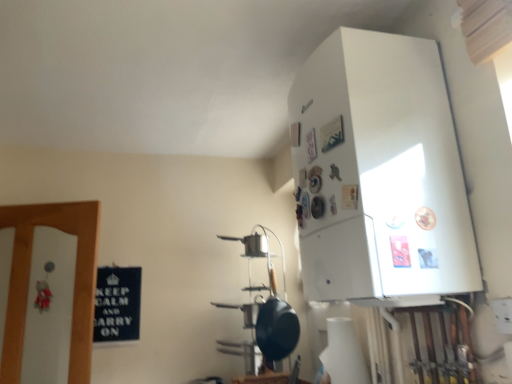
Question: From their relative heights in the image, would you say white glossy refrigerator at upper right is taller or shorter than black matte wok at center?

Choices:
 (A) tall
 (B) short

Answer: (A)

Question: From a real-world perspective, is white glossy refrigerator at upper right positioned above or below black matte wok at center?

Choices:
 (A) above
 (B) below

Answer: (A)

Question: Is white glossy refrigerator at upper right inside or outside of black matte wok at center?

Choices:
 (A) inside
 (B) outside

Answer: (B)

Question: In terms of size, does black matte wok at center appear bigger or smaller than white glossy refrigerator at upper right?

Choices:
 (A) small
 (B) big

Answer: (A)

Question: Is point (286, 347) closer or farther from the camera than point (443, 183)?

Choices:
 (A) closer
 (B) farther

Answer: (B)

Question: From the image's perspective, is black matte wok at center located above or below white glossy refrigerator at upper right?

Choices:
 (A) below
 (B) above

Answer: (A)

Question: Is black matte wok at center to the left or to the right of white glossy refrigerator at upper right in the image?

Choices:
 (A) left
 (B) right

Answer: (A)